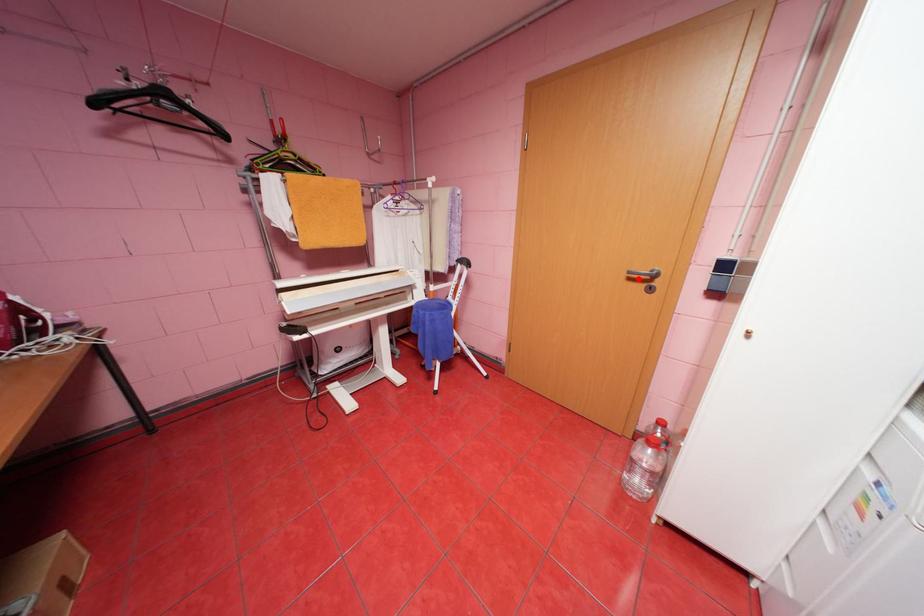
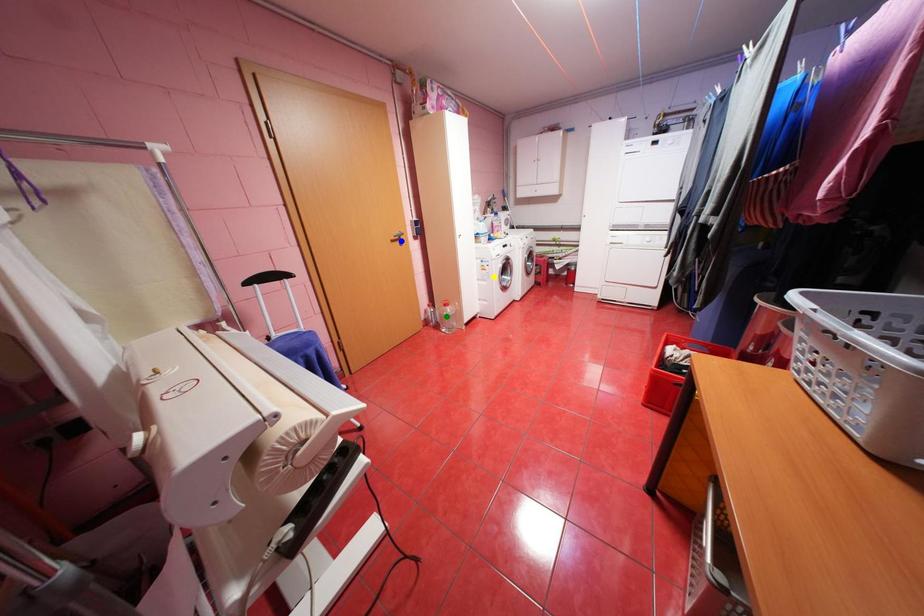
Question: I am providing you with two images of the same scene from different viewpoints. A red point is marked on the first image. You are given multiple points on the second image. In image 2, which mark is for the same physical point as the one in image 1?

Choices:
 (A) blue point
 (B) yellow point
 (C) green point

Answer: (A)